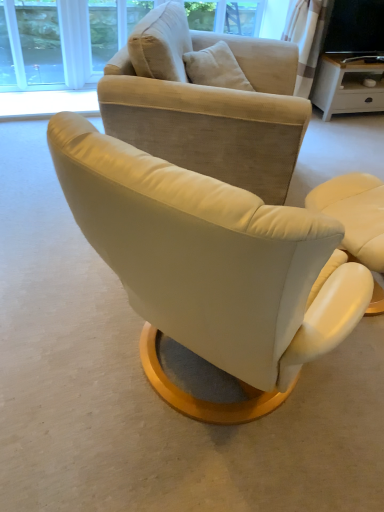
Question: Is point (221, 222) closer or farther from the camera than point (377, 99)?

Choices:
 (A) closer
 (B) farther

Answer: (A)

Question: Based on their positions, is leather armchair at center, the second chair when ordered from left to right, located to the left or right of matte white desk at upper right?

Choices:
 (A) right
 (B) left

Answer: (B)

Question: Which is farther from the suede beige armchair at center, arranged as the first chair when viewed from the left?

Choices:
 (A) leather armchair at center, positioned as the second chair in right-to-left order
 (B) matte white desk at upper right
 (C) matte black tv at upper right
 (D) matte cream armchair at center, which appears as the 1th chair when viewed from the right

Answer: (C)

Question: Based on their relative distances, which object is farther from the matte black tv at upper right?

Choices:
 (A) suede beige armchair at center, arranged as the first chair when viewed from the left
 (B) leather armchair at center, positioned as the second chair in right-to-left order
 (C) matte cream armchair at center, which appears as the 1th chair when viewed from the right
 (D) matte white desk at upper right

Answer: (B)